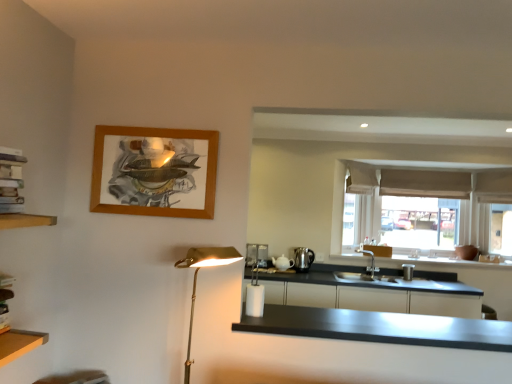
Where is `satin silver kettle at right, which ranks as the 2th appliance in left-to-right order`? The width and height of the screenshot is (512, 384). satin silver kettle at right, which ranks as the 2th appliance in left-to-right order is located at coordinates (303, 259).

Image resolution: width=512 pixels, height=384 pixels. What do you see at coordinates (303, 259) in the screenshot?
I see `satin silver kettle at right, which ranks as the 2th appliance in left-to-right order` at bounding box center [303, 259].

This screenshot has width=512, height=384. Describe the element at coordinates (377, 297) in the screenshot. I see `matte black cabinetry at lower right` at that location.

This screenshot has height=384, width=512. What are the coordinates of `matte black cabinetry at lower right` in the screenshot? It's located at (377, 297).

What do you see at coordinates (196, 279) in the screenshot?
I see `gold metallic floor lamp at left` at bounding box center [196, 279].

Locate an element on the screen. white ceramic teapot at upper right, positioned as the 2th appliance in right-to-left order is located at coordinates (282, 263).

Are matte black cabinetry at lower right and satin silver kettle at right, which ranks as the 2th appliance in left-to-right order, making contact?

No, matte black cabinetry at lower right is not next to satin silver kettle at right, which ranks as the 2th appliance in left-to-right order.

Could you tell me if matte black cabinetry at lower right is facing satin silver kettle at right, which ranks as the 2th appliance in left-to-right order?

No, matte black cabinetry at lower right is not facing towards satin silver kettle at right, which ranks as the 2th appliance in left-to-right order.

Based on the photo, from the image's perspective, would you say matte black cabinetry at lower right is positioned over satin silver kettle at right, which ranks as the 2th appliance in left-to-right order?

Incorrect, from the image's perspective, matte black cabinetry at lower right is lower than satin silver kettle at right, which ranks as the 2th appliance in left-to-right order.

Identify the location of cabinetry on the right of the satin silver kettle at right, which ranks as the 2th appliance in left-to-right order. click(x=377, y=297).

Is white ceramic teapot at upper right, which is counted as the first appliance, starting from the left, to the left of satin silver kettle at right, which is the first appliance in right-to-left order, from the viewer's perspective?

Indeed, white ceramic teapot at upper right, which is counted as the first appliance, starting from the left, is positioned on the left side of satin silver kettle at right, which is the first appliance in right-to-left order.

Considering the sizes of objects white ceramic teapot at upper right, positioned as the 2th appliance in right-to-left order, and satin silver kettle at right, which is the first appliance in right-to-left order, in the image provided, who is shorter, white ceramic teapot at upper right, positioned as the 2th appliance in right-to-left order, or satin silver kettle at right, which is the first appliance in right-to-left order,?

Standing shorter between the two is white ceramic teapot at upper right, positioned as the 2th appliance in right-to-left order.

Is satin silver kettle at right, which is the first appliance in right-to-left order, inside white ceramic teapot at upper right, positioned as the 2th appliance in right-to-left order?

No.

Is white ceramic teapot at upper right, which is counted as the first appliance, starting from the left, wider than satin silver kettle at right, which ranks as the 2th appliance in left-to-right order?

Correct, the width of white ceramic teapot at upper right, which is counted as the first appliance, starting from the left, exceeds that of satin silver kettle at right, which ranks as the 2th appliance in left-to-right order.

In the image, is beige fabric curtain at upper right positioned in front of or behind white cardboard books at left?

In the image, beige fabric curtain at upper right appears behind white cardboard books at left.

How different are the orientations of beige fabric curtain at upper right and white cardboard books at left in degrees?

The facing directions of beige fabric curtain at upper right and white cardboard books at left are 88.1 degrees apart.

Is beige fabric curtain at upper right outside of white cardboard books at left?

That's correct, beige fabric curtain at upper right is outside of white cardboard books at left.

From the image's perspective, which is above, beige fabric curtain at upper right or white cardboard books at left?

beige fabric curtain at upper right appears higher in the image.

Is wooden frame at upper left completely or partially inside beige fabric curtain at upper right?

Definitely not — wooden frame at upper left is not inside beige fabric curtain at upper right.

From a real-world perspective, between beige fabric curtain at upper right and wooden frame at upper left, who is vertically lower?

In real-world perspective, wooden frame at upper left is lower.

Does beige fabric curtain at upper right have a lesser height compared to wooden frame at upper left?

Indeed, beige fabric curtain at upper right has a lesser height compared to wooden frame at upper left.

Is beige fabric curtain at upper right positioned with its back to wooden frame at upper left?

No.

Can you tell me how much satin silver kettle at right, which is the first appliance in right-to-left order, and black matte countertop at center differ in facing direction?

The facing directions of satin silver kettle at right, which is the first appliance in right-to-left order, and black matte countertop at center are 1.72 degrees apart.

Between satin silver kettle at right, which ranks as the 2th appliance in left-to-right order, and black matte countertop at center, which one has more height?

satin silver kettle at right, which ranks as the 2th appliance in left-to-right order.

You are a GUI agent. You are given a task and a screenshot of the screen. Output one action in this format:
    pyautogui.click(x=<x>, y=<y>)
    Task: Click on the countertop below the satin silver kettle at right, which ranks as the 2th appliance in left-to-right order (from a real-world perspective)
    The height and width of the screenshot is (384, 512).
    Given the screenshot: What is the action you would take?
    pyautogui.click(x=380, y=327)

Which object is thinner, satin silver kettle at right, which is the first appliance in right-to-left order, or white cardboard books at left?

satin silver kettle at right, which is the first appliance in right-to-left order, is thinner.

Which of these two, satin silver kettle at right, which is the first appliance in right-to-left order, or white cardboard books at left, is smaller?

With smaller size is satin silver kettle at right, which is the first appliance in right-to-left order.

Is satin silver kettle at right, which is the first appliance in right-to-left order, oriented towards white cardboard books at left?

No, satin silver kettle at right, which is the first appliance in right-to-left order, is not oriented towards white cardboard books at left.

Can white cardboard books at left be found inside satin silver kettle at right, which is the first appliance in right-to-left order?

Definitely not — white cardboard books at left is not inside satin silver kettle at right, which is the first appliance in right-to-left order.

Is point (271, 283) farther from viewer compared to point (280, 262)?

No.

Between matte black cabinetry at lower right and white ceramic teapot at upper right, which is counted as the first appliance, starting from the left, which one appears on the left side from the viewer's perspective?

From the viewer's perspective, white ceramic teapot at upper right, which is counted as the first appliance, starting from the left, appears more on the left side.

Locate an element on the screen. This screenshot has height=384, width=512. appliance that is the 1st one when counting backward from the matte black cabinetry at lower right is located at coordinates (282, 263).

Does matte black cabinetry at lower right come behind white ceramic teapot at upper right, which is counted as the first appliance, starting from the left?

No, matte black cabinetry at lower right is closer to the viewer.

Where is `cabinetry in front of the satin silver kettle at right, which ranks as the 2th appliance in left-to-right order`? The height and width of the screenshot is (384, 512). cabinetry in front of the satin silver kettle at right, which ranks as the 2th appliance in left-to-right order is located at coordinates (377, 297).

This screenshot has width=512, height=384. What are the coordinates of `appliance to the left of satin silver kettle at right, which is the first appliance in right-to-left order` in the screenshot? It's located at (282, 263).

From the image, which object appears to be farther from gold metallic floor lamp at left, satin silver kettle at right, which ranks as the 2th appliance in left-to-right order, or black matte countertop at center?

Among the two, satin silver kettle at right, which ranks as the 2th appliance in left-to-right order, is located further to gold metallic floor lamp at left.

When comparing their distances from black matte countertop at center, does beige fabric window at center or matte black cabinetry at lower right seem further?

Based on the image, beige fabric window at center appears to be further to black matte countertop at center.

From the image, which object appears to be farther from black matte countertop at center, matte black cabinetry at lower right or wooden frame at upper left?

wooden frame at upper left.

When comparing their distances from beige fabric curtain at upper right, does matte black cabinetry at lower right or white cardboard books at left seem closer?

The object closer to beige fabric curtain at upper right is matte black cabinetry at lower right.

Consider the image. From the image, which object appears to be farther from wooden frame at upper left, gold metallic floor lamp at left or beige fabric curtain at upper right?

Among the two, beige fabric curtain at upper right is located further to wooden frame at upper left.

Which object lies nearer to the anchor point beige fabric window at center, wooden frame at upper left or beige fabric curtain at upper right?

beige fabric curtain at upper right lies closer to beige fabric window at center than the other object.

When comparing their distances from matte black cabinetry at lower right, does black matte countertop at center or gold metallic floor lamp at left seem further?

Among the two, gold metallic floor lamp at left is located further to matte black cabinetry at lower right.

Estimate the real-world distances between objects in this image. Which object is closer to white cardboard books at left, beige fabric curtain at upper right or wooden frame at upper left?

The object closer to white cardboard books at left is wooden frame at upper left.

Identify the location of picture frame between black matte countertop at center and beige fabric window at center along the z-axis. The width and height of the screenshot is (512, 384). (154, 171).

This screenshot has height=384, width=512. Find the location of `cabinetry between black matte countertop at center and white ceramic teapot at upper right, positioned as the 2th appliance in right-to-left order, along the z-axis`. cabinetry between black matte countertop at center and white ceramic teapot at upper right, positioned as the 2th appliance in right-to-left order, along the z-axis is located at coordinates tap(377, 297).

Image resolution: width=512 pixels, height=384 pixels. I want to click on cabinetry between white cardboard books at left and white ceramic teapot at upper right, positioned as the 2th appliance in right-to-left order, along the z-axis, so click(x=377, y=297).

This screenshot has width=512, height=384. Find the location of `cabinetry between black matte countertop at center and satin silver kettle at right, which ranks as the 2th appliance in left-to-right order, from front to back`. cabinetry between black matte countertop at center and satin silver kettle at right, which ranks as the 2th appliance in left-to-right order, from front to back is located at coordinates (377, 297).